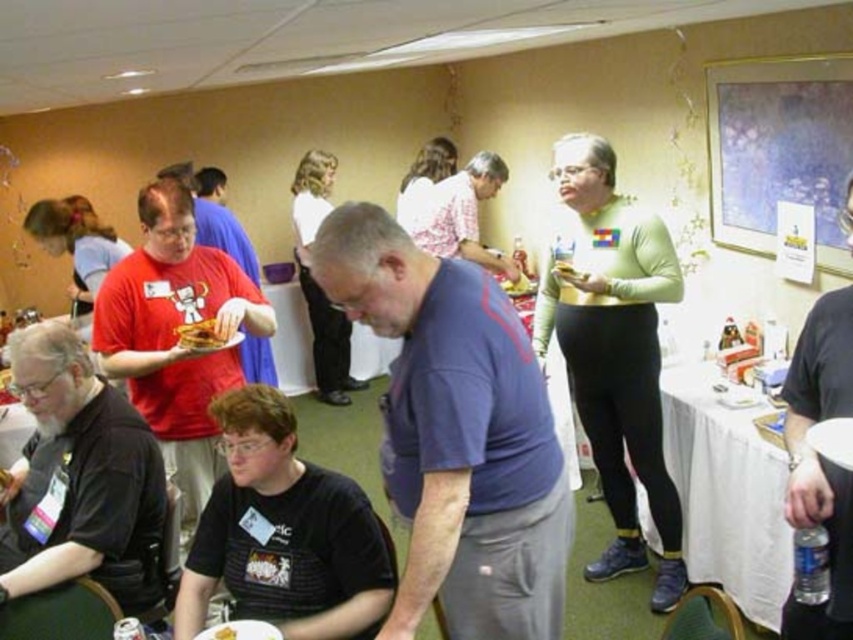
Which is behind, point (325, 214) or point (230, 621)?

Positioned behind is point (325, 214).

Who is higher up, matte black shirt at center or yellow matte cake at center?

Positioned higher is matte black shirt at center.

I want to click on matte black shirt at center, so click(316, 284).

I want to click on matte black shirt at center, so click(x=316, y=284).

How distant is white cloth table at right from yellow matte cake at center?

white cloth table at right is 1.97 meters from yellow matte cake at center.

Who is more distant from viewer, (737, 424) or (231, 627)?

The point (737, 424) is more distant.

Image resolution: width=853 pixels, height=640 pixels. What do you see at coordinates (727, 490) in the screenshot?
I see `white cloth table at right` at bounding box center [727, 490].

At what (x,y) coordinates should I click in order to perform the action: click on white cloth table at right. Please return your answer as a coordinate pair (x, y). Image resolution: width=853 pixels, height=640 pixels. Looking at the image, I should click on (727, 490).

The width and height of the screenshot is (853, 640). Describe the element at coordinates (82, 483) in the screenshot. I see `black matte shirt at lower left` at that location.

Does point (32, 486) come in front of point (846, 538)?

That is False.

Image resolution: width=853 pixels, height=640 pixels. I want to click on black matte shirt at lower left, so click(x=82, y=483).